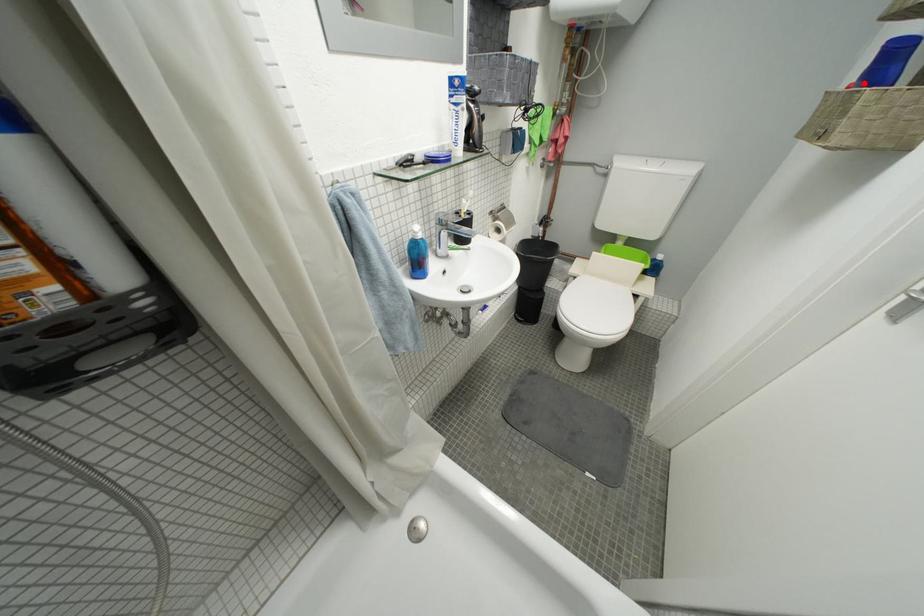
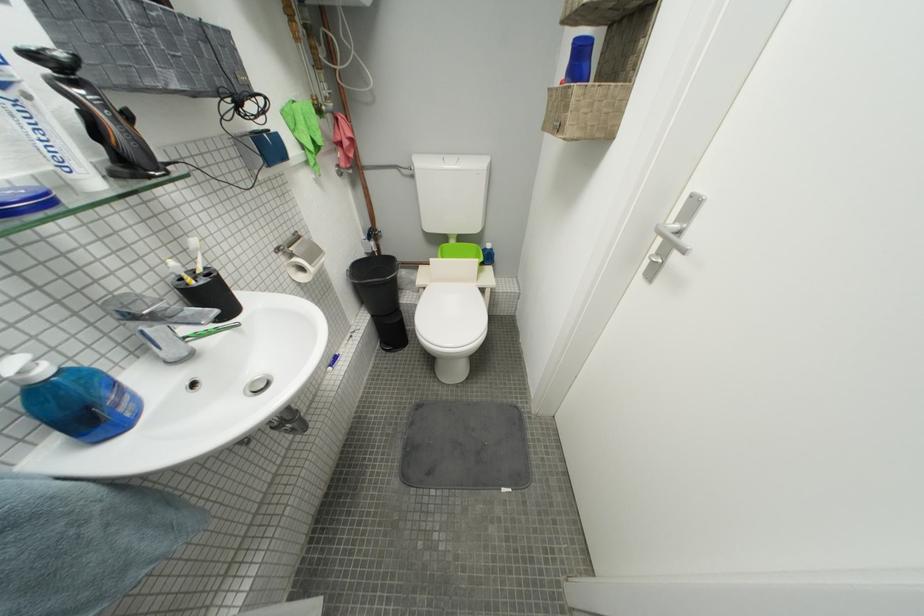
Locate, in the second image, the point that corresponds to the highlighted location in the first image.

(573, 78)